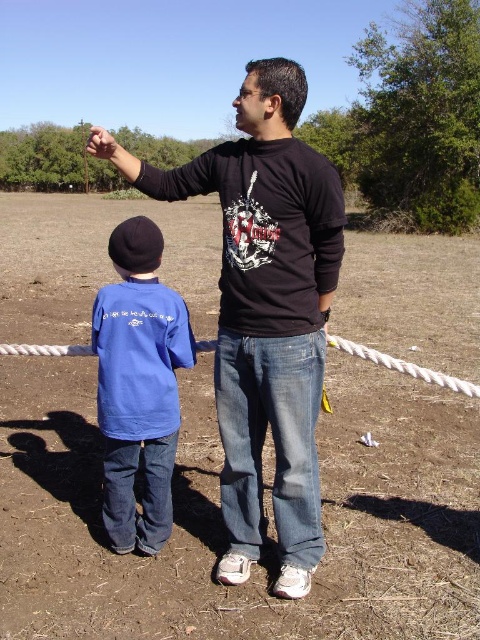
Does black cotton shirt at center have a larger size compared to blue cotton shirt at lower left?

Yes, black cotton shirt at center is bigger than blue cotton shirt at lower left.

Who is more distant from viewer, (224, 445) or (98, 381)?

Positioned behind is point (98, 381).

Is point (253, 346) positioned behind point (132, 429)?

No, (253, 346) is in front of (132, 429).

The height and width of the screenshot is (640, 480). Find the location of `black cotton shirt at center`. black cotton shirt at center is located at coordinates (264, 310).

Can you confirm if brown dirt field at center is positioned below blue cotton shirt at lower left?

Actually, brown dirt field at center is above blue cotton shirt at lower left.

Who is taller, brown dirt field at center or blue cotton shirt at lower left?

brown dirt field at center is taller.

Who is more distant from viewer, (214, 240) or (190, 324)?

The point (214, 240) is more distant.

Where is `brown dirt field at center`? The width and height of the screenshot is (480, 640). brown dirt field at center is located at coordinates (220, 518).

Find the location of a particular element. This screenshot has height=640, width=480. brown dirt field at center is located at coordinates (220, 518).

Does point (425, 323) lie in front of point (134, 163)?

No, it is behind (134, 163).

Locate an element on the screen. This screenshot has width=480, height=640. brown dirt field at center is located at coordinates (220, 518).